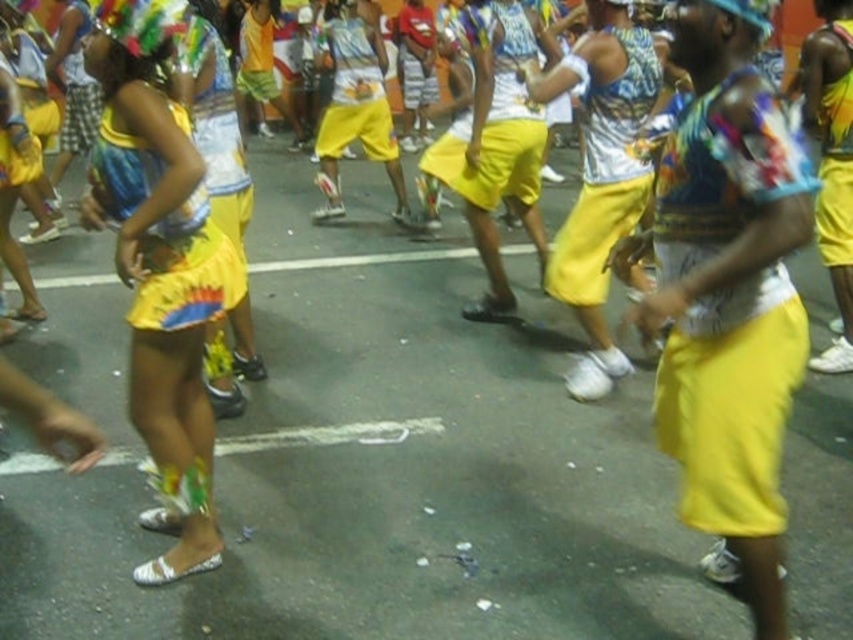
Is matte yellow shorts at right positioned in front of shiny metallic shorts at right?

Yes, matte yellow shorts at right is in front of shiny metallic shorts at right.

Between matte yellow shorts at right and shiny metallic shorts at right, which one is positioned lower?

matte yellow shorts at right is lower down.

Which is behind, point (778, 442) or point (821, 168)?

Positioned behind is point (821, 168).

Locate an element on the screen. The width and height of the screenshot is (853, 640). matte yellow shorts at right is located at coordinates (732, 401).

The width and height of the screenshot is (853, 640). Describe the element at coordinates (732, 401) in the screenshot. I see `matte yellow shorts at right` at that location.

Is point (722, 193) behind point (183, 316)?

That is False.

This screenshot has width=853, height=640. What are the coordinates of `matte yellow shorts at right` in the screenshot? It's located at (732, 401).

Who is more forward, (x=779, y=161) or (x=589, y=278)?

Point (x=779, y=161) is more forward.

Who is positioned more to the left, matte yellow shorts at right or matte yellow shorts at center?

matte yellow shorts at center is more to the left.

Between point (738, 445) and point (628, 150), which one is positioned in front?

Point (738, 445)

Find the location of a particular element. The width and height of the screenshot is (853, 640). matte yellow shorts at right is located at coordinates (732, 401).